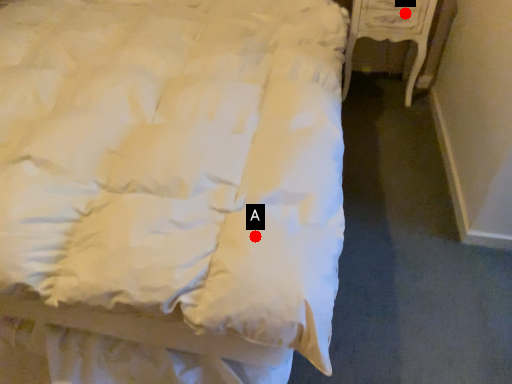
Question: Two points are circled on the image, labeled by A and B beside each circle. Which point is closer to the camera taking this photo?

Choices:
 (A) A is closer
 (B) B is closer

Answer: (A)